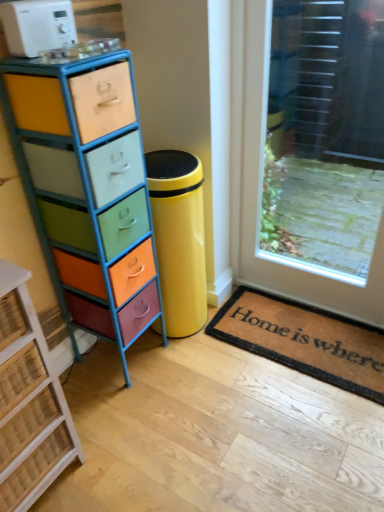
Question: Considering the relative sizes of rustic wicker chest of drawers at left, which is the 1th chest of drawers in left-to-right order, and multicolored painted wood chest of drawers at left, which is the second chest of drawers in left-to-right order, in the image provided, is rustic wicker chest of drawers at left, which is the 1th chest of drawers in left-to-right order, thinner than multicolored painted wood chest of drawers at left, which is the second chest of drawers in left-to-right order,?

Choices:
 (A) no
 (B) yes

Answer: (A)

Question: Does rustic wicker chest of drawers at left, which is the 1th chest of drawers in left-to-right order, have a greater width compared to multicolored painted wood chest of drawers at left, which is the second chest of drawers in left-to-right order?

Choices:
 (A) yes
 (B) no

Answer: (A)

Question: From the image's perspective, is rustic wicker chest of drawers at left, which is the 1th chest of drawers in left-to-right order, over multicolored painted wood chest of drawers at left, which is the 1th chest of drawers from right to left?

Choices:
 (A) yes
 (B) no

Answer: (B)

Question: Is rustic wicker chest of drawers at left, which is the 1th chest of drawers in left-to-right order, at the right side of multicolored painted wood chest of drawers at left, which is the second chest of drawers in left-to-right order?

Choices:
 (A) no
 (B) yes

Answer: (A)

Question: From a real-world perspective, is rustic wicker chest of drawers at left, which is the 1th chest of drawers in left-to-right order, beneath multicolored painted wood chest of drawers at left, which is the 1th chest of drawers from right to left?

Choices:
 (A) no
 (B) yes

Answer: (B)

Question: Is rustic wicker chest of drawers at left, the second chest of drawers from the right, facing towards multicolored painted wood chest of drawers at left, which is the second chest of drawers in left-to-right order?

Choices:
 (A) yes
 (B) no

Answer: (B)

Question: Does white plastic microwave at upper left have a smaller size compared to multicolored painted wood chest of drawers at left, which is the 1th chest of drawers from right to left?

Choices:
 (A) yes
 (B) no

Answer: (A)

Question: Is white plastic microwave at upper left next to multicolored painted wood chest of drawers at left, which is the 1th chest of drawers from right to left?

Choices:
 (A) yes
 (B) no

Answer: (B)

Question: Does white plastic microwave at upper left come in front of multicolored painted wood chest of drawers at left, which is the 1th chest of drawers from right to left?

Choices:
 (A) no
 (B) yes

Answer: (A)

Question: Could you tell me if white plastic microwave at upper left is facing multicolored painted wood chest of drawers at left, which is the second chest of drawers in left-to-right order?

Choices:
 (A) no
 (B) yes

Answer: (A)

Question: Is white plastic microwave at upper left positioned with its back to multicolored painted wood chest of drawers at left, which is the second chest of drawers in left-to-right order?

Choices:
 (A) no
 (B) yes

Answer: (A)

Question: Is white plastic microwave at upper left thinner than multicolored painted wood chest of drawers at left, which is the 1th chest of drawers from right to left?

Choices:
 (A) yes
 (B) no

Answer: (A)

Question: From the image's perspective, is multicolored painted wood chest of drawers at left, which is the 1th chest of drawers from right to left, located beneath white plastic microwave at upper left?

Choices:
 (A) no
 (B) yes

Answer: (B)